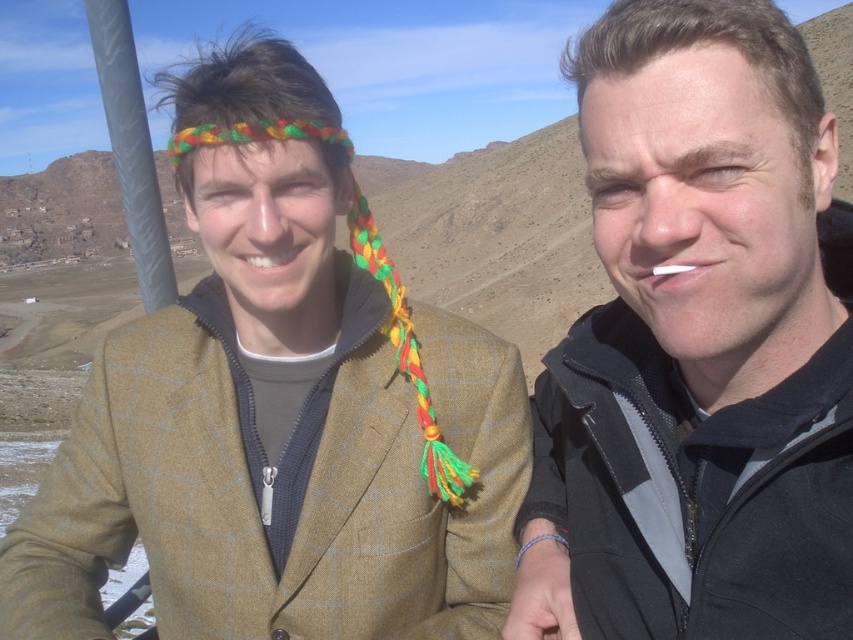
Is metallic gray pole at left thinner than multicolored braided headscarf at left?

No.

Is point (163, 294) in front of point (361, 209)?

No, (163, 294) is further to viewer.

Locate an element on the screen. This screenshot has height=640, width=853. metallic gray pole at left is located at coordinates (131, 148).

Is the position of matte black jacket at right more distant than that of metallic gray pole at left?

No, matte black jacket at right is in front of metallic gray pole at left.

Is matte black jacket at right positioned in front of metallic gray pole at left?

Yes, it is in front of metallic gray pole at left.

Who is more distant from viewer, (544, 388) or (138, 140)?

The point (138, 140) is behind.

You are a GUI agent. You are given a task and a screenshot of the screen. Output one action in this format:
    pyautogui.click(x=<x>, y=<y>)
    Task: Click on the matte black jacket at right
    
    Given the screenshot: What is the action you would take?
    pyautogui.click(x=697, y=346)

Who is taller, matte black jacket at right or multicolored braided headscarf at left?

matte black jacket at right is taller.

Locate an element on the screen. The height and width of the screenshot is (640, 853). matte black jacket at right is located at coordinates (697, 346).